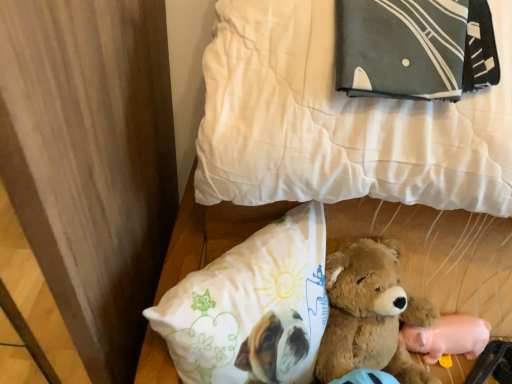
The width and height of the screenshot is (512, 384). Describe the element at coordinates (361, 149) in the screenshot. I see `white quilted bed at upper center` at that location.

The image size is (512, 384). Describe the element at coordinates (448, 337) in the screenshot. I see `pink rubber pig at lower right` at that location.

Find the location of `white soft pillow at upper center, placed as the 2th pillow when sorted from bottom to top`. white soft pillow at upper center, placed as the 2th pillow when sorted from bottom to top is located at coordinates (340, 121).

From a real-world perspective, which object stands above the other?

white soft pillow at upper center, the 1th pillow when ordered from top to bottom.

Between white fabric pillow at lower center, which is the 2th pillow in top-to-bottom order, and white soft pillow at upper center, the 1th pillow when ordered from top to bottom, which one is positioned in front?

white soft pillow at upper center, the 1th pillow when ordered from top to bottom, is in front.

Considering the relative sizes of white fabric pillow at lower center, arranged as the 1th pillow when ordered from the bottom, and white soft pillow at upper center, placed as the 2th pillow when sorted from bottom to top, in the image provided, is white fabric pillow at lower center, arranged as the 1th pillow when ordered from the bottom, bigger than white soft pillow at upper center, placed as the 2th pillow when sorted from bottom to top,?

Actually, white fabric pillow at lower center, arranged as the 1th pillow when ordered from the bottom, might be smaller than white soft pillow at upper center, placed as the 2th pillow when sorted from bottom to top.

Is point (162, 328) positioned after point (430, 144)?

Yes, it is.

The image size is (512, 384). Find the location of `toy on the right of white soft pillow at upper center, placed as the 2th pillow when sorted from bottom to top`. toy on the right of white soft pillow at upper center, placed as the 2th pillow when sorted from bottom to top is located at coordinates (448, 337).

From the image's perspective, which is below, white soft pillow at upper center, placed as the 2th pillow when sorted from bottom to top, or pink rubber pig at lower right?

pink rubber pig at lower right appears lower in the image.

Is white soft pillow at upper center, placed as the 2th pillow when sorted from bottom to top, not close to pink rubber pig at lower right?

Actually, white soft pillow at upper center, placed as the 2th pillow when sorted from bottom to top, and pink rubber pig at lower right are a little close together.

Looking at this image, can you confirm if white soft pillow at upper center, the 1th pillow when ordered from top to bottom, is smaller than pink rubber pig at lower right?

Actually, white soft pillow at upper center, the 1th pillow when ordered from top to bottom, might be larger than pink rubber pig at lower right.

Which object is further away from the camera taking this photo, white soft pillow at upper center, the 1th pillow when ordered from top to bottom, or white quilted bed at upper center?

white soft pillow at upper center, the 1th pillow when ordered from top to bottom.

Is white soft pillow at upper center, placed as the 2th pillow when sorted from bottom to top, not within white quilted bed at upper center?

No, white soft pillow at upper center, placed as the 2th pillow when sorted from bottom to top, is not outside of white quilted bed at upper center.

Can you see white soft pillow at upper center, placed as the 2th pillow when sorted from bottom to top, touching white quilted bed at upper center?

Yes, the surface of white soft pillow at upper center, placed as the 2th pillow when sorted from bottom to top, is in contact with white quilted bed at upper center.

Can you confirm if white soft pillow at upper center, the 1th pillow when ordered from top to bottom, is smaller than white quilted bed at upper center?

Correct, white soft pillow at upper center, the 1th pillow when ordered from top to bottom, occupies less space than white quilted bed at upper center.

Between white fabric pillow at lower center, which is the 2th pillow in top-to-bottom order, and white quilted bed at upper center, which one has smaller size?

white fabric pillow at lower center, which is the 2th pillow in top-to-bottom order, is smaller.

From a real-world perspective, count 1st pillows upward from the white quilted bed at upper center and point to it. Please provide its 2D coordinates.

[(251, 304)]

Can you tell me how much white fabric pillow at lower center, which is the 2th pillow in top-to-bottom order, and white quilted bed at upper center differ in facing direction?

46.8 degrees.

Would you consider white fabric pillow at lower center, which is the 2th pillow in top-to-bottom order, to be distant from white quilted bed at upper center?

They are positioned close to each other.

How many degrees apart are the facing directions of white fabric pillow at lower center, which is the 2th pillow in top-to-bottom order, and pink rubber pig at lower right?

47 degrees separate the facing orientations of white fabric pillow at lower center, which is the 2th pillow in top-to-bottom order, and pink rubber pig at lower right.

From the image's perspective, who appears lower, white fabric pillow at lower center, which is the 2th pillow in top-to-bottom order, or pink rubber pig at lower right?

From the image's view, pink rubber pig at lower right is below.

Is white fabric pillow at lower center, which is the 2th pillow in top-to-bottom order, in front of or behind pink rubber pig at lower right in the image?

Clearly, white fabric pillow at lower center, which is the 2th pillow in top-to-bottom order, is in front of pink rubber pig at lower right.

Is point (306, 274) farther from camera compared to point (423, 351)?

No, (306, 274) is in front of (423, 351).

Is white quilted bed at upper center to the left or to the right of white fabric pillow at lower center, arranged as the 1th pillow when ordered from the bottom, in the image?

In the image, white quilted bed at upper center appears on the right side of white fabric pillow at lower center, arranged as the 1th pillow when ordered from the bottom.

Is point (224, 135) behind point (324, 322)?

That is False.

Considering the relative sizes of white quilted bed at upper center and white fabric pillow at lower center, arranged as the 1th pillow when ordered from the bottom, in the image provided, is white quilted bed at upper center bigger than white fabric pillow at lower center, arranged as the 1th pillow when ordered from the bottom,?

Yes.

From a real-world perspective, relative to white fabric pillow at lower center, which is the 2th pillow in top-to-bottom order, is white quilted bed at upper center vertically above or below?

Clearly, from a real-world perspective, white quilted bed at upper center is below white fabric pillow at lower center, which is the 2th pillow in top-to-bottom order.

Based on the photo, is the position of white soft pillow at upper center, placed as the 2th pillow when sorted from bottom to top, more distant than that of white fabric pillow at lower center, arranged as the 1th pillow when ordered from the bottom?

No.

Which object is wider, white soft pillow at upper center, the 1th pillow when ordered from top to bottom, or white fabric pillow at lower center, arranged as the 1th pillow when ordered from the bottom?

white soft pillow at upper center, the 1th pillow when ordered from top to bottom.

Is white fabric pillow at lower center, arranged as the 1th pillow when ordered from the bottom, inside white soft pillow at upper center, the 1th pillow when ordered from top to bottom?

No.

From a real-world perspective, is white soft pillow at upper center, placed as the 2th pillow when sorted from bottom to top, located beneath white fabric pillow at lower center, arranged as the 1th pillow when ordered from the bottom?

Incorrect, from a real-world perspective, white soft pillow at upper center, placed as the 2th pillow when sorted from bottom to top, is higher than white fabric pillow at lower center, arranged as the 1th pillow when ordered from the bottom.

This screenshot has height=384, width=512. Find the location of `pillow on the right of white fabric pillow at lower center, which is the 2th pillow in top-to-bottom order`. pillow on the right of white fabric pillow at lower center, which is the 2th pillow in top-to-bottom order is located at coordinates (340, 121).

From a real-world perspective, starting from the pink rubber pig at lower right, which pillow is the 2nd one vertically above it? Please provide its 2D coordinates.

[(340, 121)]

Considering their positions, is pink rubber pig at lower right positioned further to white soft pillow at upper center, the 1th pillow when ordered from top to bottom, than white fabric pillow at lower center, arranged as the 1th pillow when ordered from the bottom?

pink rubber pig at lower right is positioned further to the anchor white soft pillow at upper center, the 1th pillow when ordered from top to bottom.

When comparing their distances from white quilted bed at upper center, does white fabric pillow at lower center, which is the 2th pillow in top-to-bottom order, or white soft pillow at upper center, placed as the 2th pillow when sorted from bottom to top, seem further?

Based on the image, white fabric pillow at lower center, which is the 2th pillow in top-to-bottom order, appears to be further to white quilted bed at upper center.

When comparing their distances from white fabric pillow at lower center, arranged as the 1th pillow when ordered from the bottom, does pink rubber pig at lower right or white quilted bed at upper center seem further?

The object further to white fabric pillow at lower center, arranged as the 1th pillow when ordered from the bottom, is pink rubber pig at lower right.

From the image, which object appears to be nearer to white fabric pillow at lower center, arranged as the 1th pillow when ordered from the bottom, white quilted bed at upper center or white soft pillow at upper center, the 1th pillow when ordered from top to bottom?

white quilted bed at upper center is positioned closer to the anchor white fabric pillow at lower center, arranged as the 1th pillow when ordered from the bottom.

From the image, which object appears to be farther from white quilted bed at upper center, white fabric pillow at lower center, which is the 2th pillow in top-to-bottom order, or pink rubber pig at lower right?

pink rubber pig at lower right is positioned further to the anchor white quilted bed at upper center.

When comparing their distances from pink rubber pig at lower right, does white quilted bed at upper center or white fabric pillow at lower center, which is the 2th pillow in top-to-bottom order, seem closer?

white quilted bed at upper center.

From the image, which object appears to be farther from white quilted bed at upper center, pink rubber pig at lower right or white fabric pillow at lower center, arranged as the 1th pillow when ordered from the bottom?

The object further to white quilted bed at upper center is pink rubber pig at lower right.

When comparing their distances from white fabric pillow at lower center, arranged as the 1th pillow when ordered from the bottom, does white soft pillow at upper center, placed as the 2th pillow when sorted from bottom to top, or white quilted bed at upper center seem closer?

The object closer to white fabric pillow at lower center, arranged as the 1th pillow when ordered from the bottom, is white quilted bed at upper center.

Locate an element on the screen. pillow between white soft pillow at upper center, the 1th pillow when ordered from top to bottom, and pink rubber pig at lower right vertically is located at coordinates (251, 304).

Where is `bed between white soft pillow at upper center, the 1th pillow when ordered from top to bottom, and white fabric pillow at lower center, which is the 2th pillow in top-to-bottom order, in the vertical direction`? bed between white soft pillow at upper center, the 1th pillow when ordered from top to bottom, and white fabric pillow at lower center, which is the 2th pillow in top-to-bottom order, in the vertical direction is located at coordinates (361, 149).